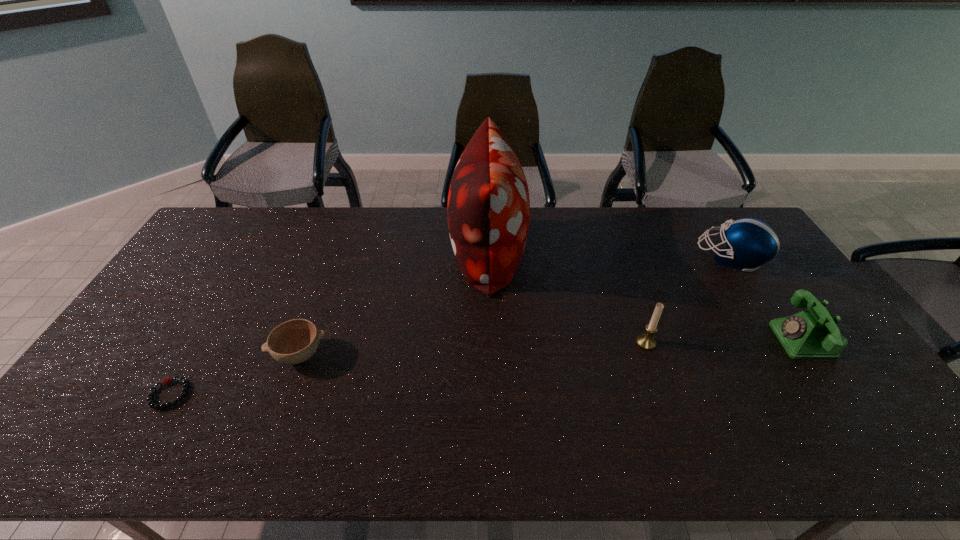
The height and width of the screenshot is (540, 960). I want to click on the tallest object, so click(488, 210).

I want to click on the fourth object from right to left, so click(488, 210).

Identify the location of football helmet. The image size is (960, 540). (750, 242).

Where is `the fourth object from left to right`? The width and height of the screenshot is (960, 540). the fourth object from left to right is located at coordinates (646, 341).

The image size is (960, 540). What are the coordinates of `the fourth tallest object` in the screenshot? It's located at (813, 334).

Identify the location of bowl. Image resolution: width=960 pixels, height=540 pixels. (294, 341).

The image size is (960, 540). Identify the location of the second object from left to right. (x=294, y=341).

Identify the location of the leftmost object. tap(168, 380).

I want to click on bracelet, so click(168, 380).

At what (x,y) coordinates should I click in order to perform the action: click on free location located 0.080m on the front-facing side of the third object from left to right. Please return your answer as a coordinate pair (x, y). This screenshot has height=540, width=960. Looking at the image, I should click on (427, 252).